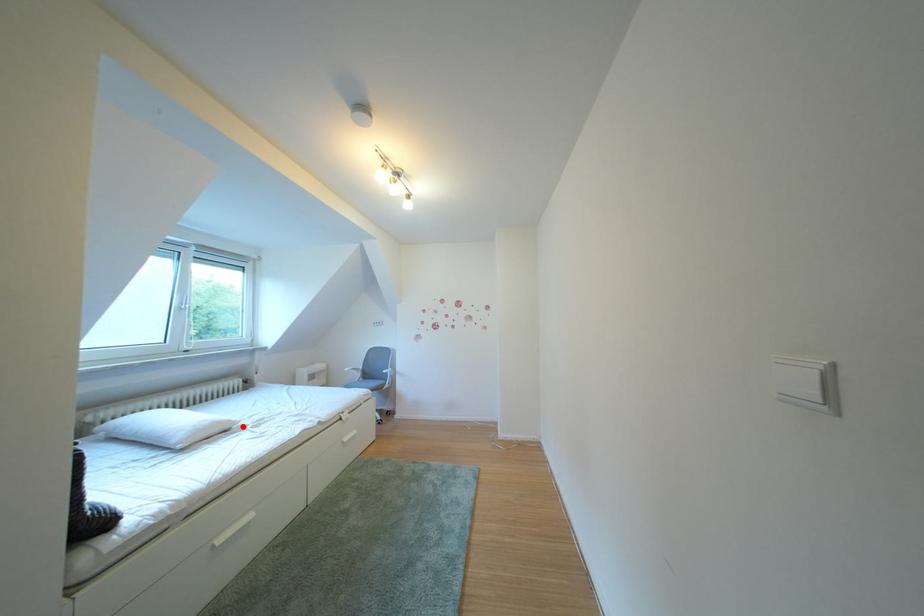
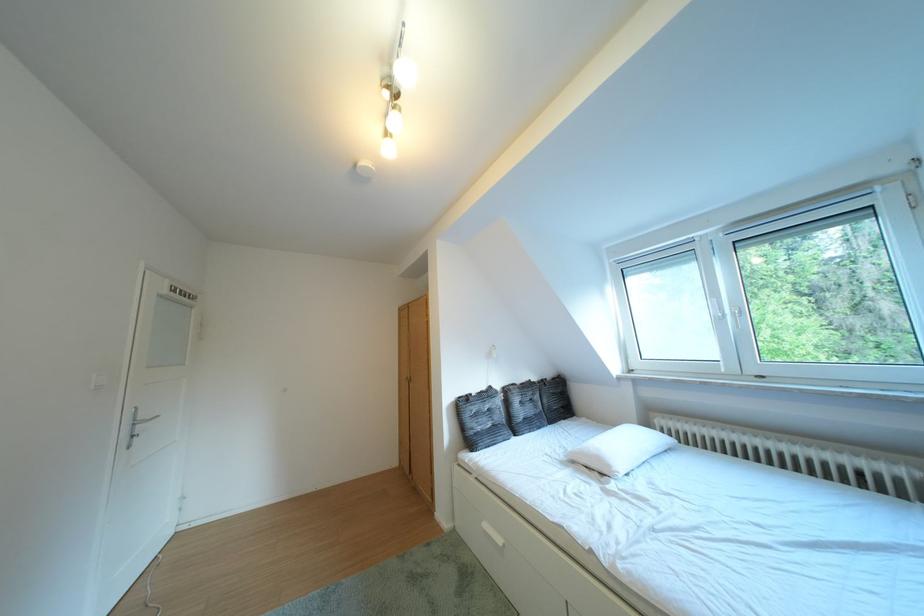
Find the pixel in the second image that matches the highlighted location in the first image.

(623, 471)